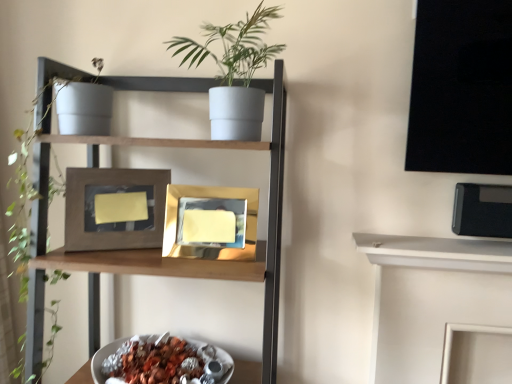
Question: Is matte brown picture frame at center, acting as the second picture frame starting from the right, shorter than gold reflective photo frame at center, the 2th picture frame from the left?

Choices:
 (A) no
 (B) yes

Answer: (A)

Question: Is matte brown picture frame at center, which appears as the first picture frame when viewed from the left, oriented away from gold reflective photo frame at center, the 2th picture frame from the left?

Choices:
 (A) no
 (B) yes

Answer: (A)

Question: Is matte brown picture frame at center, acting as the second picture frame starting from the right, taller than gold reflective photo frame at center, the 2th picture frame from the left?

Choices:
 (A) yes
 (B) no

Answer: (A)

Question: Is matte brown picture frame at center, acting as the second picture frame starting from the right, far from gold reflective photo frame at center, the first picture frame viewed from the right?

Choices:
 (A) yes
 (B) no

Answer: (B)

Question: Is matte brown picture frame at center, acting as the second picture frame starting from the right, wider than gold reflective photo frame at center, the first picture frame viewed from the right?

Choices:
 (A) no
 (B) yes

Answer: (A)

Question: From the image's perspective, is white matte pot at upper center positioned above or below gold reflective photo frame at center, the 2th picture frame from the left?

Choices:
 (A) below
 (B) above

Answer: (B)

Question: Based on their positions, is white matte pot at upper center located to the left or right of gold reflective photo frame at center, the 2th picture frame from the left?

Choices:
 (A) left
 (B) right

Answer: (B)

Question: Considering the positions of white matte pot at upper center and gold reflective photo frame at center, the 2th picture frame from the left, in the image, is white matte pot at upper center bigger or smaller than gold reflective photo frame at center, the 2th picture frame from the left,?

Choices:
 (A) small
 (B) big

Answer: (B)

Question: Would you say white matte pot at upper center is inside or outside gold reflective photo frame at center, the 2th picture frame from the left?

Choices:
 (A) outside
 (B) inside

Answer: (A)

Question: Looking at their shapes, would you say white matte pot at upper center is wider or thinner than matte gray pot at upper left?

Choices:
 (A) wide
 (B) thin

Answer: (B)

Question: Do you think white matte pot at upper center is within matte gray pot at upper left, or outside of it?

Choices:
 (A) inside
 (B) outside

Answer: (B)

Question: Is white matte pot at upper center taller or shorter than matte gray pot at upper left?

Choices:
 (A) tall
 (B) short

Answer: (B)

Question: Does point (256, 64) appear closer or farther from the camera than point (39, 374)?

Choices:
 (A) farther
 (B) closer

Answer: (B)

Question: Based on their positions, is white matte pot at upper center located to the left or right of shiny metallic bowl at lower center?

Choices:
 (A) left
 (B) right

Answer: (B)

Question: Is white matte pot at upper center inside the boundaries of shiny metallic bowl at lower center, or outside?

Choices:
 (A) outside
 (B) inside

Answer: (A)